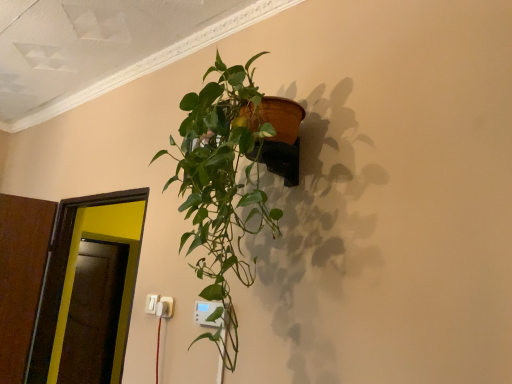
Question: Would you say white plastic electric outlet at lower left, positioned as the first electric outlet in back-to-front order, is to the left or to the right of transparent glass door at left in the picture?

Choices:
 (A) left
 (B) right

Answer: (B)

Question: In terms of width, does white plastic electric outlet at lower left, positioned as the first electric outlet in back-to-front order, look wider or thinner when compared to transparent glass door at left?

Choices:
 (A) wide
 (B) thin

Answer: (B)

Question: Which object is positioned farthest from the white plastic electric outlet at lower left, the third electric outlet positioned from the front?

Choices:
 (A) green glossy plant at upper center
 (B) transparent glass door at left
 (C) white plastic electric outlet at lower center, which is the 2th electric outlet in front-to-back order
 (D) white plastic electric outlet at lower center, acting as the 3th electric outlet starting from the back

Answer: (A)

Question: Considering the real-world distances, which object is farthest from the white plastic electric outlet at lower left, the third electric outlet positioned from the front?

Choices:
 (A) white plastic electric outlet at lower center, the second electric outlet in the right-to-left sequence
 (B) white plastic electric outlet at lower center, the first electric outlet when ordered from front to back
 (C) transparent glass door at left
 (D) green glossy plant at upper center

Answer: (D)